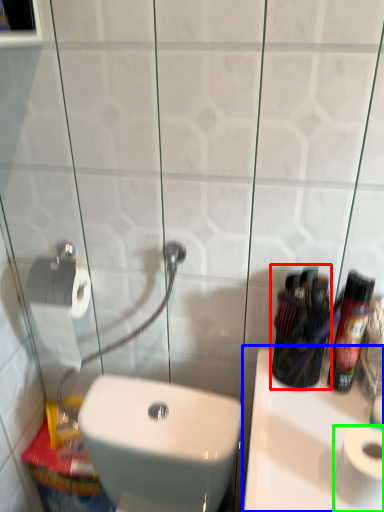
Question: Considering the real-world distances, which object is farthest from mouthwash (highlighted by a red box)? sink (highlighted by a blue box) or toilet paper (highlighted by a green box)?

Choices:
 (A) sink
 (B) toilet paper

Answer: (B)